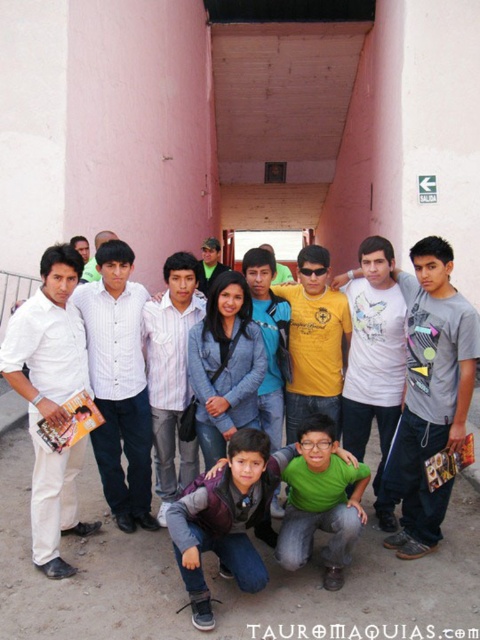
Question: Is white striped shirt at center positioned in front of white matte t-shirt at center?

Choices:
 (A) no
 (B) yes

Answer: (B)

Question: Does gray cotton t-shirt at center appear over striped cotton shirt at center?

Choices:
 (A) yes
 (B) no

Answer: (A)

Question: Which point is closer to the camera?

Choices:
 (A) matte yellow shirt at center
 (B) white matte t-shirt at center
 (C) white shirt at center
 (D) gray cotton t-shirt at center

Answer: (D)

Question: Which of the following is the closest to the observer?

Choices:
 (A) gray cotton t-shirt at center
 (B) striped cotton shirt at center

Answer: (A)

Question: Is white matte shirt at left wider than white matte t-shirt at center?

Choices:
 (A) no
 (B) yes

Answer: (B)

Question: Which point is farther to the camera?

Choices:
 (A) (160, 305)
 (B) (36, 512)
 (C) (385, 355)
 (D) (113, 481)

Answer: (A)